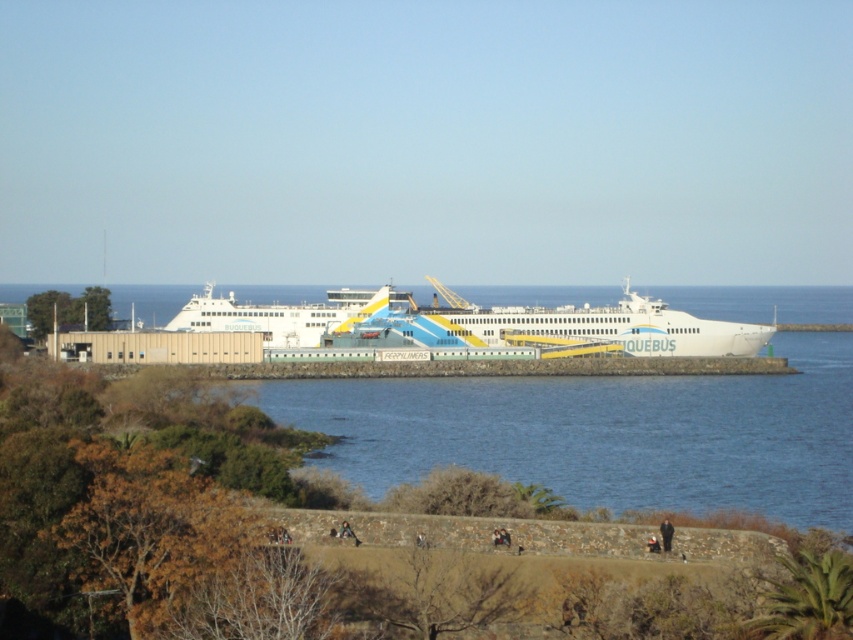
Does white glossy ferry at center have a larger size compared to black fabric person at lower right?

Correct, white glossy ferry at center is larger in size than black fabric person at lower right.

Is white glossy ferry at center in front of black fabric person at lower right?

No.

Where is `white glossy ferry at center`? This screenshot has width=853, height=640. white glossy ferry at center is located at coordinates (476, 324).